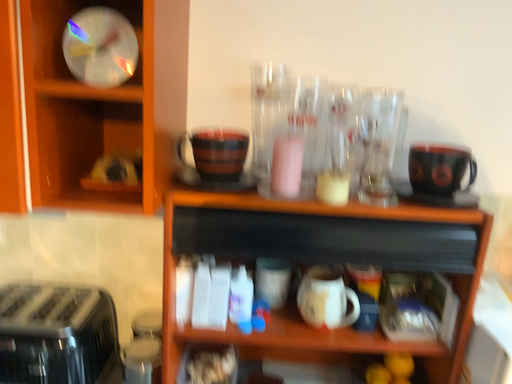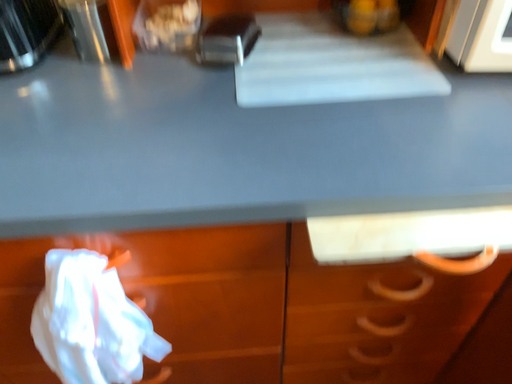
Question: Which way did the camera rotate in the video?

Choices:
 (A) rotated downward
 (B) rotated upward

Answer: (A)